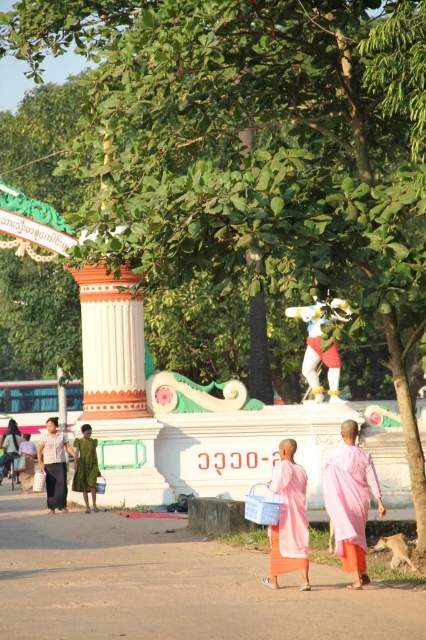
In the scene shown: You are standing at point (x=288, y=518) in the image. What object is exactly at your current position?

The pink silk robe at center is exactly at point (x=288, y=518).

You are standing at the monument and want to take a photo of the pink silk robe at center. Where should you position yourself to capture the robe in the frame?

The pink silk robe at center is located at point (288, 518), so position yourself so the camera is aimed at those coordinates to capture the robe in the frame.